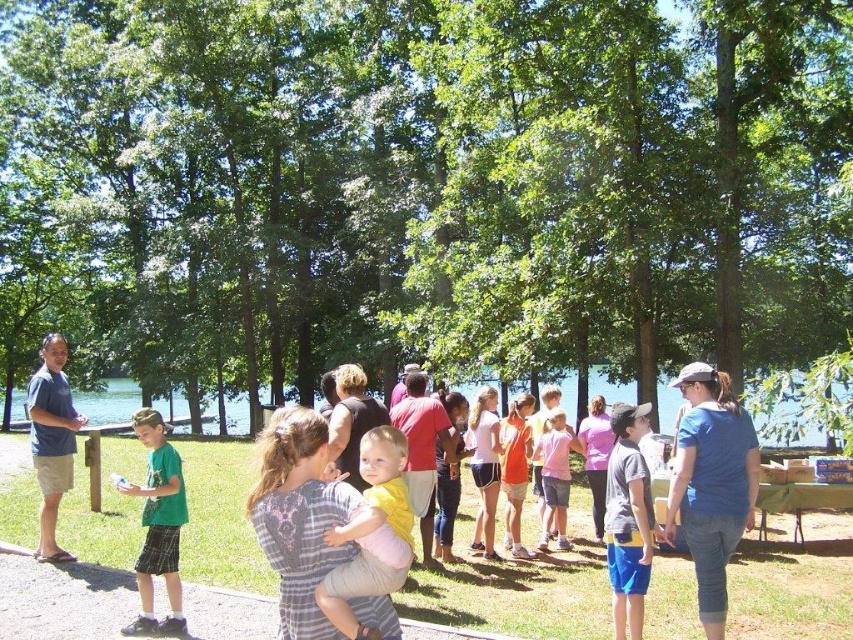
Who is shorter, yellow fabric shirt at center or gray cotton t-shirt at center?

Standing shorter between the two is yellow fabric shirt at center.

Who is more distant from viewer, (380, 532) or (622, 636)?

Positioned behind is point (622, 636).

Does point (345, 632) come farther from viewer compared to point (613, 547)?

No, (345, 632) is closer to viewer.

Locate an element on the screen. This screenshot has height=640, width=853. yellow fabric shirt at center is located at coordinates (370, 534).

Who is more forward, (132, 625) or (239, 422)?

Point (132, 625)

Does green matte shirt at left appear on the right side of clear blue water at center?

Correct, you'll find green matte shirt at left to the right of clear blue water at center.

Describe the element at coordinates (157, 525) in the screenshot. I see `green matte shirt at left` at that location.

The height and width of the screenshot is (640, 853). I want to click on green matte shirt at left, so click(157, 525).

Is point (50, 506) farther from camera compared to point (566, 448)?

No.

In the scene shown: Between matte blue shirt at left and pink cotton shirt at center, which one has less height?

Standing shorter between the two is pink cotton shirt at center.

Find the location of a particular element. This screenshot has height=640, width=853. matte blue shirt at left is located at coordinates (51, 440).